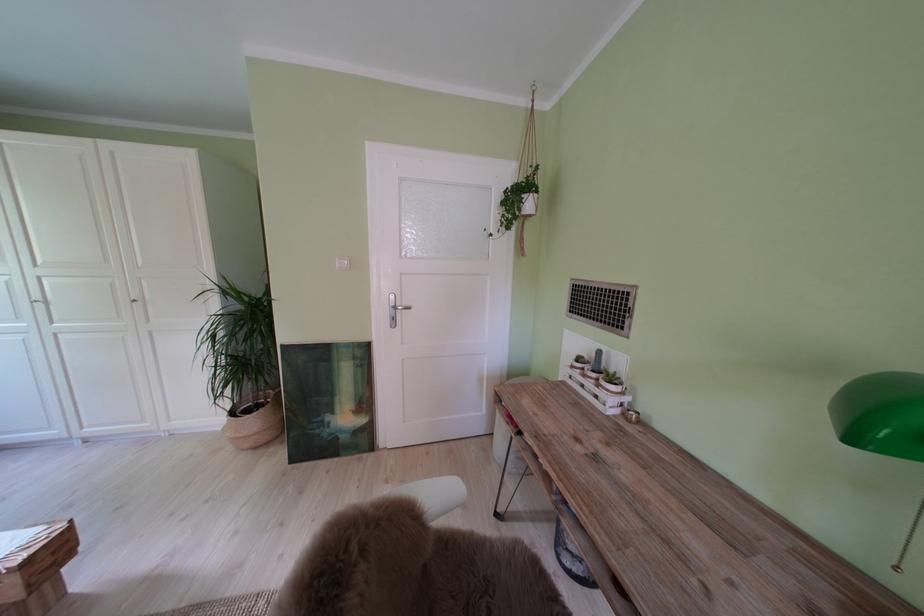
Locate an element on the screen. Image resolution: width=924 pixels, height=616 pixels. lamp pull chain is located at coordinates (907, 538).